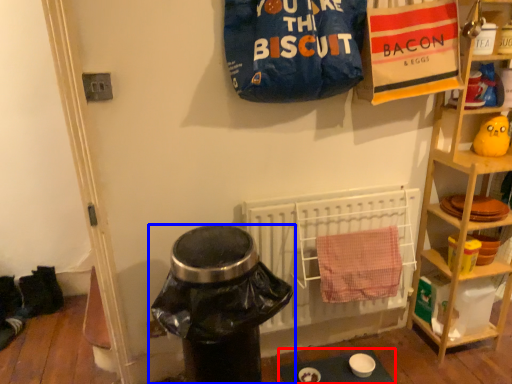
Question: Which object appears closest to the camera in this image, table (highlighted by a red box) or trash bin/can (highlighted by a blue box)?

Choices:
 (A) table
 (B) trash bin/can

Answer: (B)